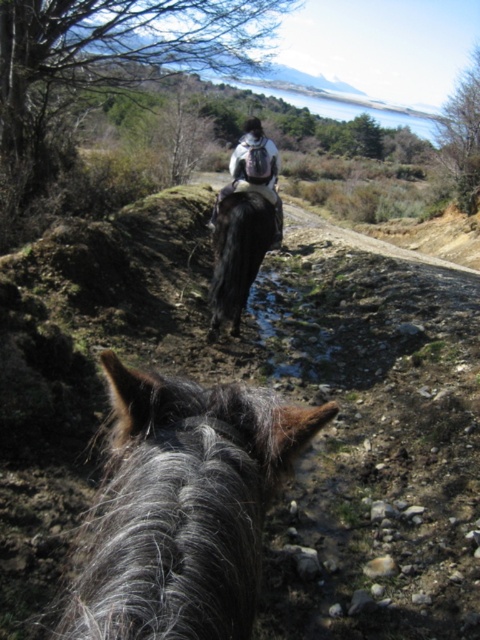
Who is higher up, dark brown fur at center or white matte backpack at center?

Positioned higher is white matte backpack at center.

Find the location of a particular element. The height and width of the screenshot is (640, 480). dark brown fur at center is located at coordinates (240, 250).

Is gray fuzzy horse at center closer to the viewer compared to white matte backpack at center?

Yes, gray fuzzy horse at center is in front of white matte backpack at center.

Consider the image. Is gray fuzzy horse at center shorter than white matte backpack at center?

Correct, gray fuzzy horse at center is not as tall as white matte backpack at center.

Between point (201, 403) and point (263, 192), which one is positioned in front?

Point (201, 403)

Identify the location of gray fuzzy horse at center. (182, 508).

Can you confirm if gray fuzzy horse at center is shorter than dark brown fur at center?

Correct, gray fuzzy horse at center is not as tall as dark brown fur at center.

Which is behind, point (172, 577) or point (240, 221)?

The point (240, 221) is more distant.

Identify the location of gray fuzzy horse at center. (182, 508).